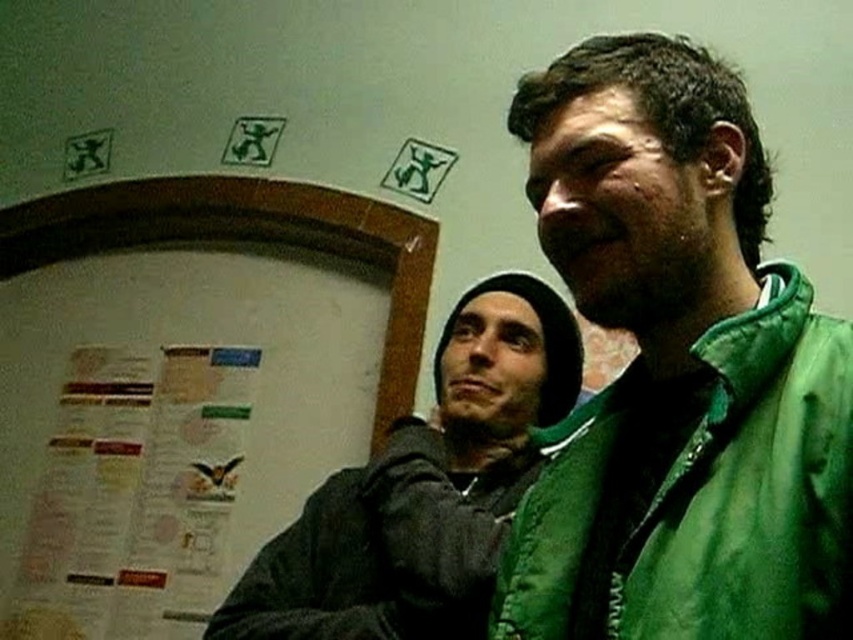
Question: Where is green quilted jacket at right located in relation to dark gray hoodie at center in the image?

Choices:
 (A) right
 (B) left

Answer: (A)

Question: Among these objects, which one is farthest from the camera?

Choices:
 (A) green quilted jacket at right
 (B) paper poster at left
 (C) dark gray hoodie at center

Answer: (B)

Question: Among these objects, which one is farthest from the camera?

Choices:
 (A) green quilted jacket at right
 (B) white paper at left
 (C) paper poster at left
 (D) dark gray hoodie at center

Answer: (C)

Question: From the image, what is the correct spatial relationship of green quilted jacket at right in relation to paper poster at left?

Choices:
 (A) left
 (B) right

Answer: (B)

Question: Which object is farther from the camera taking this photo?

Choices:
 (A) green quilted jacket at right
 (B) dark gray hoodie at center

Answer: (B)

Question: Does green quilted jacket at right have a larger size compared to dark gray hoodie at center?

Choices:
 (A) yes
 (B) no

Answer: (B)